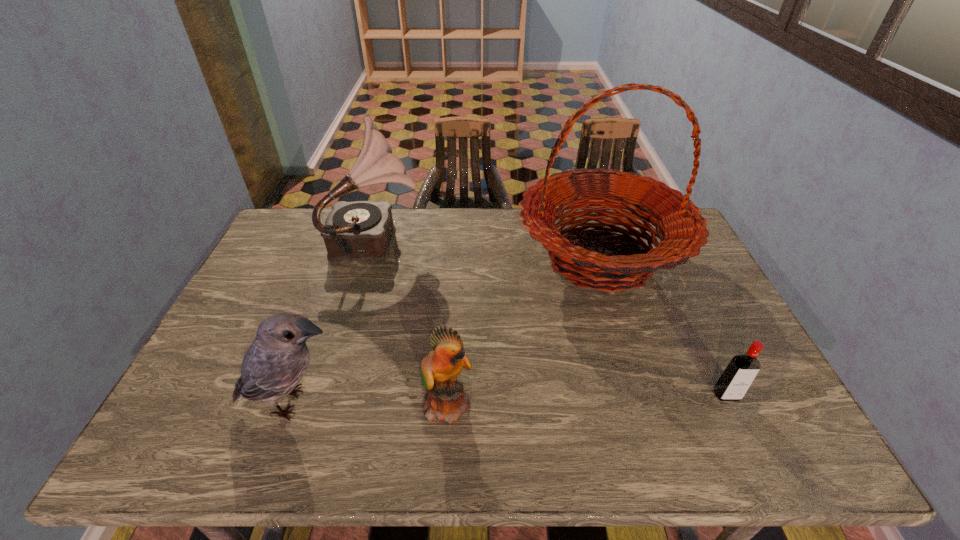
Identify the location of basket located at the far edge. The image size is (960, 540). (680, 227).

At what (x,y) coordinates should I click in order to perform the action: click on record player that is positioned at the far edge. Please return your answer as a coordinate pair (x, y). Looking at the image, I should click on (361, 230).

Find the location of `object that is at the near edge`. object that is at the near edge is located at coordinates (446, 401).

You are a GUI agent. You are given a task and a screenshot of the screen. Output one action in this format:
    pyautogui.click(x=<x>, y=<y>)
    Task: Click on the object that is at the left edge
    Image resolution: width=960 pixels, height=540 pixels.
    Given the screenshot: What is the action you would take?
    pyautogui.click(x=278, y=358)

Locate an element on the screen. The height and width of the screenshot is (540, 960). basket situated at the right edge is located at coordinates (680, 227).

What are the coordinates of `vodka that is at the right edge` in the screenshot? It's located at (734, 382).

Where is `object at the far right corner`? This screenshot has width=960, height=540. object at the far right corner is located at coordinates (680, 227).

Identify the location of vacant space at the far edge of the desktop. The height and width of the screenshot is (540, 960). (515, 209).

Image resolution: width=960 pixels, height=540 pixels. In the image, there is a desktop. Find the location of `blank space at the near edge`. blank space at the near edge is located at coordinates (693, 428).

Find the location of a particular element. The width and height of the screenshot is (960, 540). free region at the left edge is located at coordinates (227, 400).